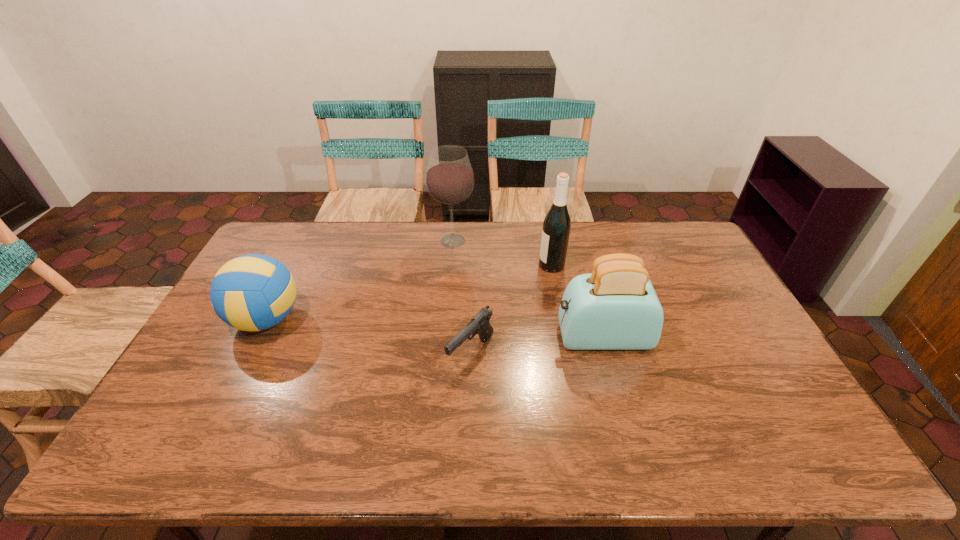
At what (x,y) coordinates should I click in order to perform the action: click on empty space between the third tallest object and the leftmost object. Please return your answer as a coordinate pair (x, y). Looking at the image, I should click on (434, 328).

Locate an element on the screen. vacant area that lies between the wine bottle and the volleyball is located at coordinates (409, 292).

Select which object appears as the closest to the wine bottle. Please provide its 2D coordinates. Your answer should be formatted as a tuple, i.e. [(x, y)], where the tuple contains the x and y coordinates of a point satisfying the conditions above.

[(615, 307)]

Locate which object is the second closest to the leftmost object. Please provide its 2D coordinates. Your answer should be formatted as a tuple, i.e. [(x, y)], where the tuple contains the x and y coordinates of a point satisfying the conditions above.

[(479, 324)]

Where is `free space that satisfies the following two spatial constraints: 1. on the side of the toaster with the lever; 2. at the muzzle of the shortest object`? free space that satisfies the following two spatial constraints: 1. on the side of the toaster with the lever; 2. at the muzzle of the shortest object is located at coordinates (607, 354).

Where is `free space that satisfies the following two spatial constraints: 1. on the label of the second farthest object; 2. on the front side of the volleyball`? free space that satisfies the following two spatial constraints: 1. on the label of the second farthest object; 2. on the front side of the volleyball is located at coordinates 562,319.